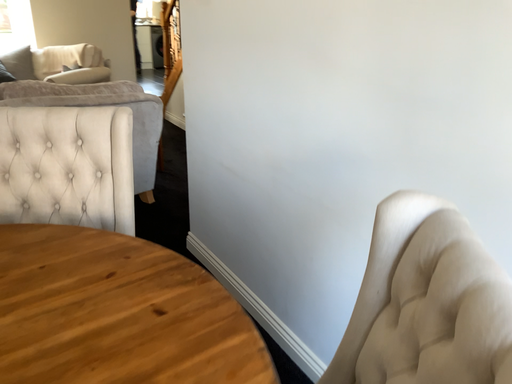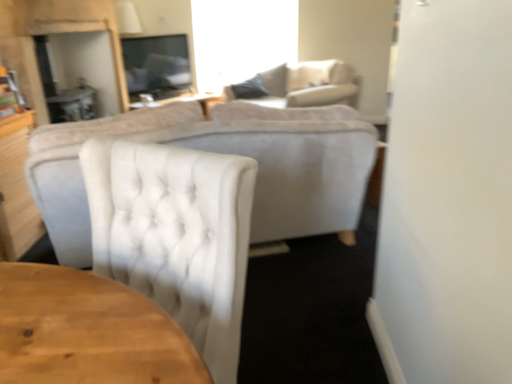
Question: Which way did the camera rotate in the video?

Choices:
 (A) rotated right
 (B) rotated left

Answer: (B)